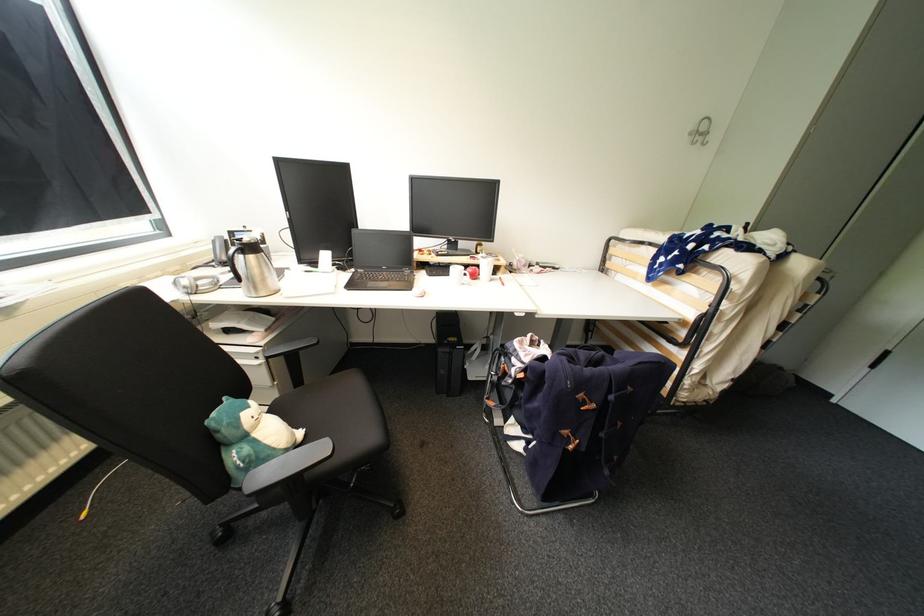
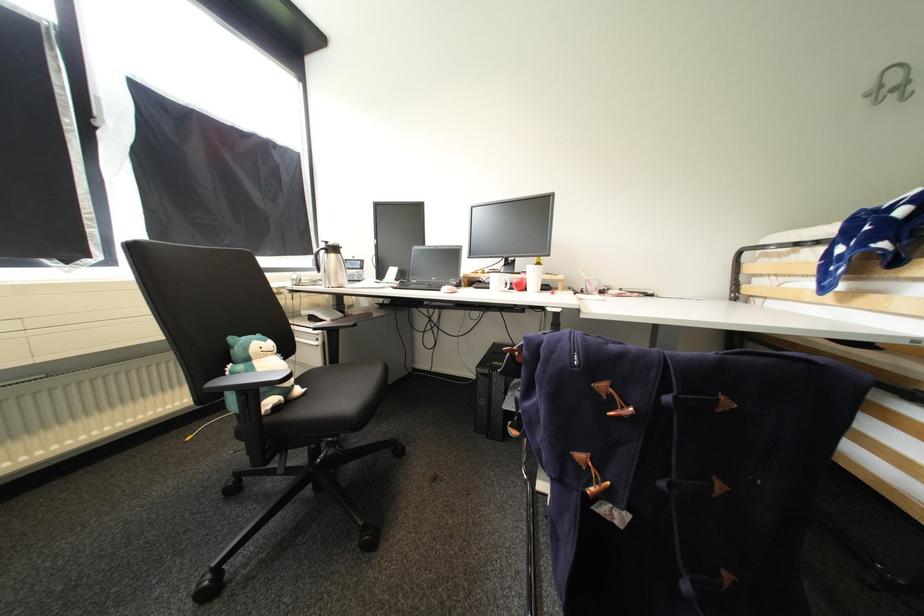
Find the pixel in the second image that matches the point at 307,435 in the first image.

(306, 391)